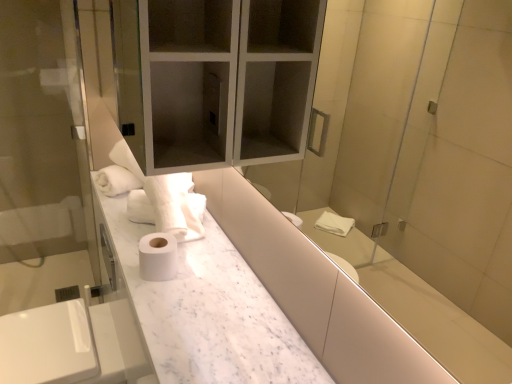
Identify the location of blank space situated above white marble counter at center (from a real-world perspective). (181, 279).